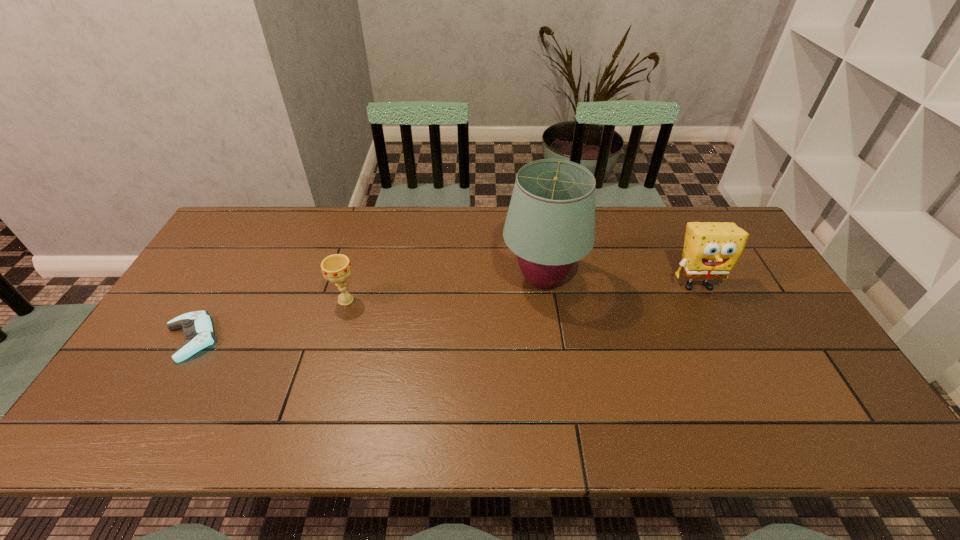
Where is `lampshade`? lampshade is located at coordinates (550, 224).

This screenshot has width=960, height=540. I want to click on the tallest object, so click(550, 224).

Image resolution: width=960 pixels, height=540 pixels. Find the location of `sponge`. sponge is located at coordinates (711, 249).

Find the location of a particular element. the second tallest object is located at coordinates (711, 249).

Locate an element on the screen. chalice is located at coordinates coord(336,268).

I want to click on the third object from right to left, so click(336, 268).

Image resolution: width=960 pixels, height=540 pixels. I want to click on the leftmost object, so click(198, 330).

Where is `the nearest object`? the nearest object is located at coordinates (198, 330).

The image size is (960, 540). Find the location of `blank space located 0.260m on the left of the third object from left to right`. blank space located 0.260m on the left of the third object from left to right is located at coordinates (415, 280).

This screenshot has width=960, height=540. I want to click on vacant space situated on the face of the sponge, so click(x=717, y=325).